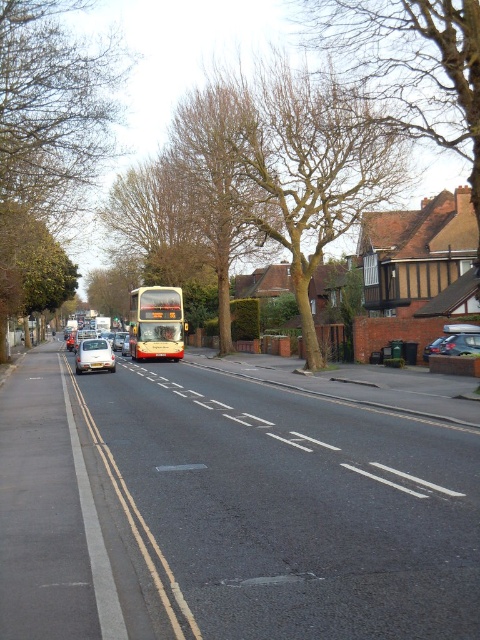
Measure the distance between brown leafless tree at upper center and camera.

brown leafless tree at upper center is 78.42 feet away from camera.

Can you confirm if brown leafless tree at upper center is thinner than yellow metallic bus at center?

No, brown leafless tree at upper center is not thinner than yellow metallic bus at center.

Measure the distance between point (295, 205) and camera.

Point (295, 205) is 118.99 feet away from camera.

Locate an element on the screen. The width and height of the screenshot is (480, 640). brown leafless tree at upper center is located at coordinates (305, 168).

Which is in front, point (64, 12) or point (291, 209)?

Point (64, 12) is more forward.

Does point (45, 154) come closer to viewer compared to point (385, 180)?

Yes, point (45, 154) is in front of point (385, 180).

Which is behind, point (119, 104) or point (317, 156)?

The point (317, 156) is behind.

Locate an element on the screen. This screenshot has height=640, width=480. brown leafless tree at upper left is located at coordinates (48, 147).

Which is behind, point (395, 52) or point (90, 339)?

The point (90, 339) is behind.

How far apart are bare branches at upper center and white matte car at left?

The distance of bare branches at upper center from white matte car at left is 18.12 meters.

Does point (392, 68) come in front of point (94, 353)?

Yes, it is in front of point (94, 353).

Where is `bare branches at upper center`? The image size is (480, 640). bare branches at upper center is located at coordinates (408, 65).